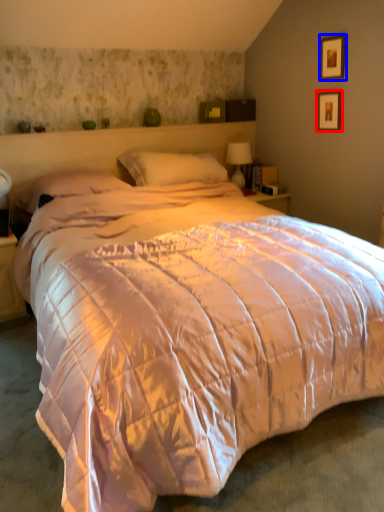
Question: Which point is closer to the camera, picture frame (highlighted by a red box) or picture frame (highlighted by a blue box)?

Choices:
 (A) picture frame
 (B) picture frame

Answer: (B)